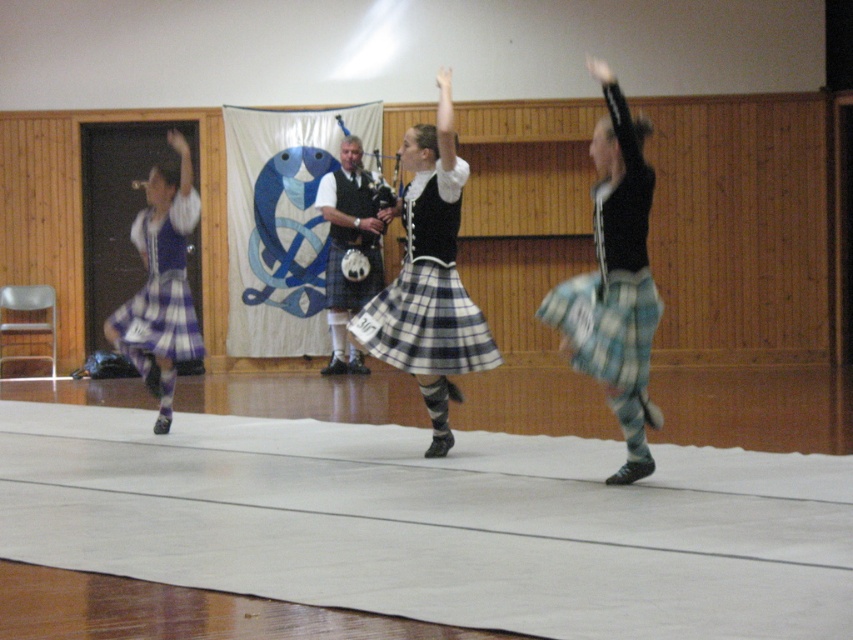
Can you confirm if black plaid skirt at center is positioned to the left of blue plaid skirt at left?

In fact, black plaid skirt at center is to the right of blue plaid skirt at left.

Who is shorter, black plaid skirt at center or blue plaid skirt at left?

With less height is blue plaid skirt at left.

Where is `black plaid skirt at center`? black plaid skirt at center is located at coordinates (428, 289).

This screenshot has width=853, height=640. Find the location of `black plaid skirt at center`. black plaid skirt at center is located at coordinates (428, 289).

Is plaid skirt at center positioned at the back of blue plaid skirt at left?

No, it is not.

Does plaid skirt at center have a greater width compared to blue plaid skirt at left?

In fact, plaid skirt at center might be narrower than blue plaid skirt at left.

Between point (641, 205) and point (136, 246), which one is positioned in front?

Positioned in front is point (641, 205).

You are a GUI agent. You are given a task and a screenshot of the screen. Output one action in this format:
    pyautogui.click(x=<x>, y=<y>)
    Task: Click on the plaid skirt at center
    The width and height of the screenshot is (853, 640).
    Given the screenshot: What is the action you would take?
    pyautogui.click(x=618, y=276)

Can you confirm if plaid skirt at center is smaller than black plaid skirt at center?

Actually, plaid skirt at center might be larger than black plaid skirt at center.

Is point (625, 250) closer to viewer compared to point (442, 280)?

Yes, point (625, 250) is in front of point (442, 280).

The image size is (853, 640). Find the location of `plaid skirt at center`. plaid skirt at center is located at coordinates (618, 276).